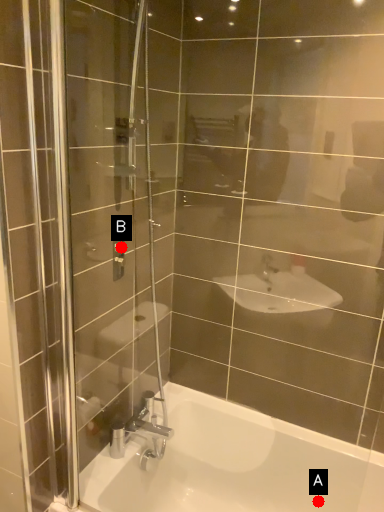
Question: Two points are circled on the image, labeled by A and B beside each circle. Which point is further to the camera?

Choices:
 (A) A is further
 (B) B is further

Answer: (A)